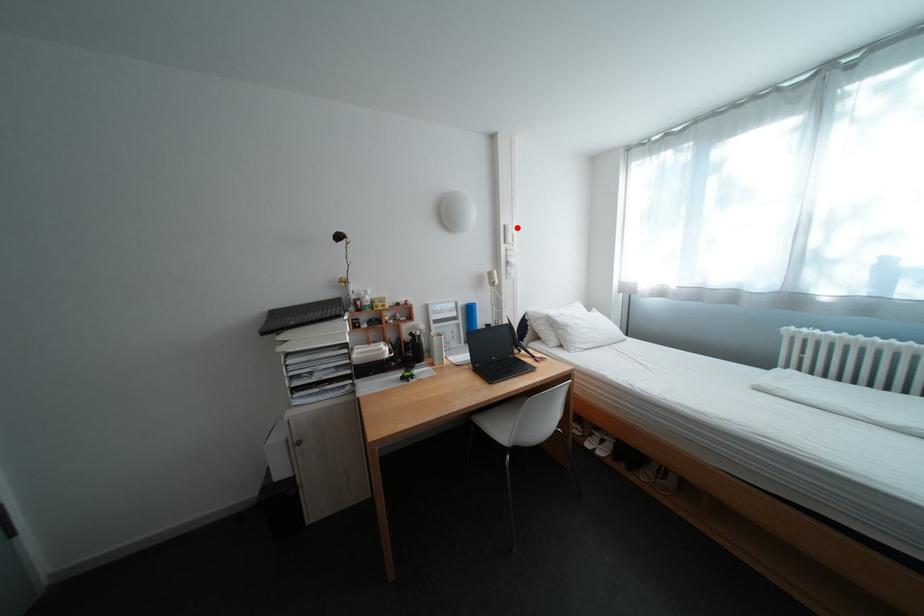
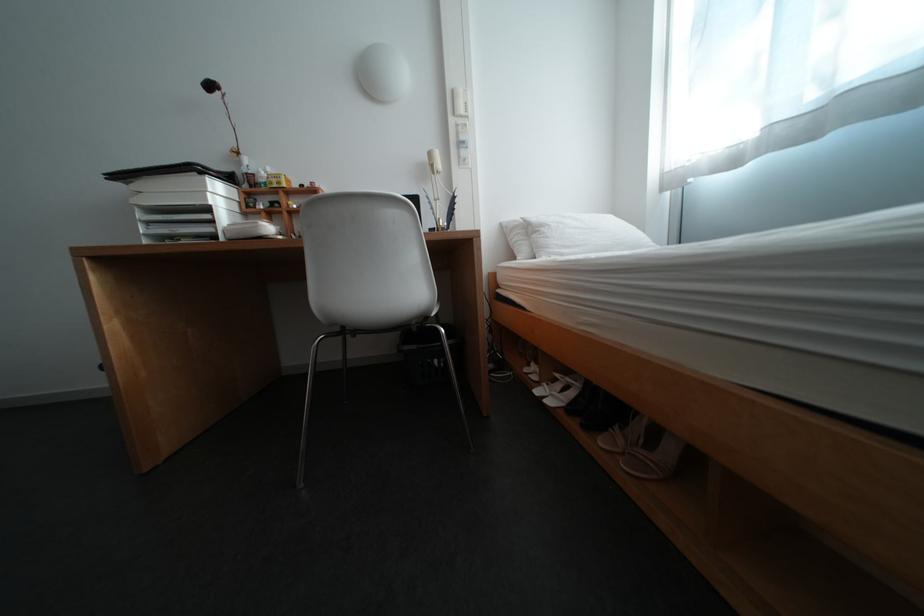
Locate, in the second image, the point that corresponds to the highlighted location in the first image.

(466, 92)